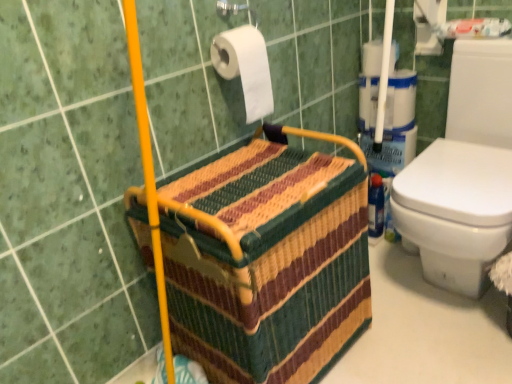
Where is `vacant space to the right of multicolored woven basket at center`? vacant space to the right of multicolored woven basket at center is located at coordinates (405, 336).